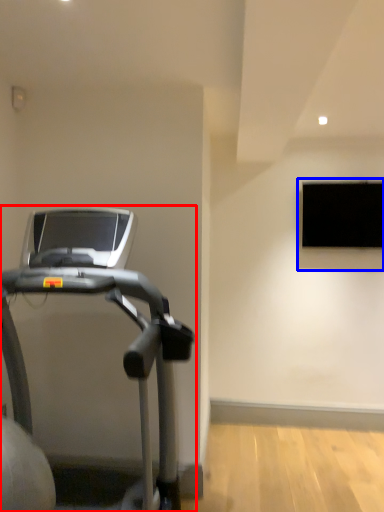
Question: Which of the following is the closest to the observer, treadmill (highlighted by a red box) or window (highlighted by a blue box)?

Choices:
 (A) treadmill
 (B) window

Answer: (A)